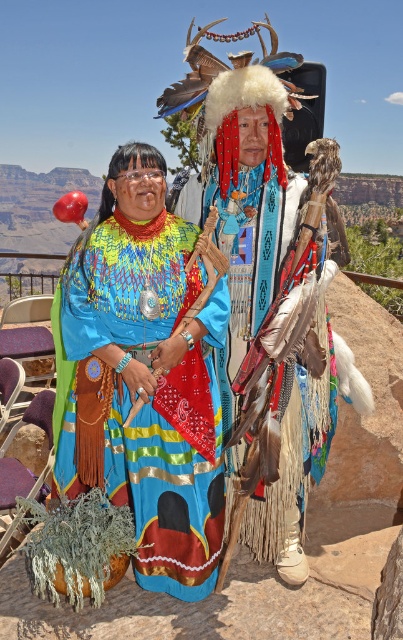
You are a photographer planning to take a group photo of the two individuals in the scene. You want to ensure that both the matte blue fabric dress at center and the multicolored woven fabric at center are fully visible in the frame. Based on their sizes, which dress should you position closer to the camera to avoid any overlap?

The matte blue fabric dress at center has a larger width than the multicolored woven fabric at center. To ensure both are fully visible without overlap, position the matte blue fabric dress at center closer to the camera so its larger size can be accommodated in the frame.